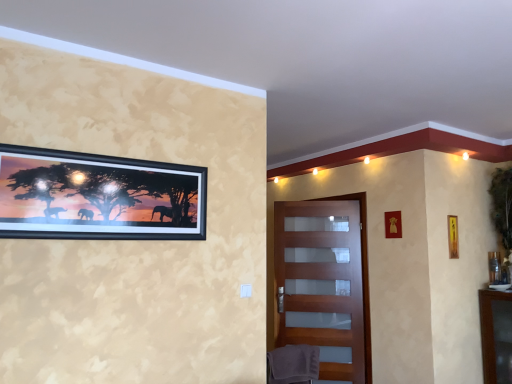
How much space does metallic gold picture frame at right, which is the fourth picture frame in front-to-back order, occupy horizontally?

4.09 inches.

What do you see at coordinates (98, 196) in the screenshot? I see `black matte picture frame at upper left, positioned as the 1th picture frame in front-to-back order` at bounding box center [98, 196].

At what (x,y) coordinates should I click in order to perform the action: click on wooden picture frame at upper right, placed as the 3th picture frame when sorted from back to front. Please return your answer as a coordinate pair (x, y). Looking at the image, I should click on (453, 237).

This screenshot has height=384, width=512. What do you see at coordinates (393, 224) in the screenshot?
I see `metallic gold picture frame at upper right, which is the third picture frame in right-to-left order` at bounding box center [393, 224].

What do you see at coordinates (325, 283) in the screenshot? The image size is (512, 384). I see `matte wooden door at center` at bounding box center [325, 283].

In order to face gray fabric swivel chair at lower center, should I rotate leftwards or rightwards?

You should rotate right by 5.059 degrees.

The width and height of the screenshot is (512, 384). What are the coordinates of `metallic gold picture frame at right, which is counted as the 1th picture frame, starting from the right` in the screenshot? It's located at (495, 267).

Is metallic gold picture frame at right, arranged as the 1th picture frame when viewed from the back, positioned beyond the bounds of black matte picture frame at upper left, which appears as the fourth picture frame when viewed from the right?

Yes, metallic gold picture frame at right, arranged as the 1th picture frame when viewed from the back, is not within black matte picture frame at upper left, which appears as the fourth picture frame when viewed from the right.

Which of these two, metallic gold picture frame at right, positioned as the fourth picture frame in left-to-right order, or black matte picture frame at upper left, positioned as the 1th picture frame in front-to-back order, is bigger?

black matte picture frame at upper left, positioned as the 1th picture frame in front-to-back order, is bigger.

How different are the orientations of metallic gold picture frame at right, arranged as the 1th picture frame when viewed from the back, and black matte picture frame at upper left, positioned as the 1th picture frame in front-to-back order, in degrees?

The facing directions of metallic gold picture frame at right, arranged as the 1th picture frame when viewed from the back, and black matte picture frame at upper left, positioned as the 1th picture frame in front-to-back order, are 89.3 degrees apart.

From the image's perspective, who appears lower, metallic gold picture frame at right, which is the fourth picture frame in front-to-back order, or black matte picture frame at upper left, arranged as the first picture frame when viewed from the left?

From the image's view, metallic gold picture frame at right, which is the fourth picture frame in front-to-back order, is below.

Is wooden picture frame at upper right, positioned as the second picture frame in front-to-back order, wider or thinner than gray fabric swivel chair at lower center?

In the image, wooden picture frame at upper right, positioned as the second picture frame in front-to-back order, appears to be more narrow than gray fabric swivel chair at lower center.

Could you measure the distance between wooden picture frame at upper right, placed as the 3th picture frame when sorted from left to right, and gray fabric swivel chair at lower center?

wooden picture frame at upper right, placed as the 3th picture frame when sorted from left to right, and gray fabric swivel chair at lower center are 1.85 meters apart from each other.

At what (x,y) coordinates should I click in order to perform the action: click on swivel chair below the wooden picture frame at upper right, placed as the 3th picture frame when sorted from left to right (from the image's perspective). Please return your answer as a coordinate pair (x, y). Looking at the image, I should click on (293, 364).

Consider the image. From the image's perspective, who appears lower, wooden picture frame at upper right, acting as the 2th picture frame starting from the right, or gray fabric swivel chair at lower center?

gray fabric swivel chair at lower center appears lower in the image.

From the picture: Does matte wooden door at center have a larger size compared to metallic gold picture frame at right, which is the fourth picture frame in front-to-back order?

Indeed, matte wooden door at center has a larger size compared to metallic gold picture frame at right, which is the fourth picture frame in front-to-back order.

Visually, is matte wooden door at center positioned to the left or to the right of metallic gold picture frame at right, which is counted as the 1th picture frame, starting from the right?

Clearly, matte wooden door at center is on the left of metallic gold picture frame at right, which is counted as the 1th picture frame, starting from the right, in the image.

From the image's perspective, is matte wooden door at center located beneath metallic gold picture frame at right, positioned as the fourth picture frame in left-to-right order?

Yes, from the image's perspective, matte wooden door at center is below metallic gold picture frame at right, positioned as the fourth picture frame in left-to-right order.

In the scene shown: Is matte wooden door at center completely or partially outside of metallic gold picture frame at right, which is counted as the 1th picture frame, starting from the right?

matte wooden door at center is positioned outside metallic gold picture frame at right, which is counted as the 1th picture frame, starting from the right.

Is wooden picture frame at upper right, acting as the 2th picture frame starting from the right, wider than matte wooden door at center?

Incorrect, the width of wooden picture frame at upper right, acting as the 2th picture frame starting from the right, does not surpass that of matte wooden door at center.

Considering the sizes of objects wooden picture frame at upper right, positioned as the second picture frame in front-to-back order, and matte wooden door at center in the image provided, who is smaller, wooden picture frame at upper right, positioned as the second picture frame in front-to-back order, or matte wooden door at center?

wooden picture frame at upper right, positioned as the second picture frame in front-to-back order, is smaller.

Based on the photo, what's the angular difference between wooden picture frame at upper right, acting as the 2th picture frame starting from the right, and matte wooden door at center's facing directions?

The angle between the facing direction of wooden picture frame at upper right, acting as the 2th picture frame starting from the right, and the facing direction of matte wooden door at center is 25.7 degrees.

Would you say wooden picture frame at upper right, placed as the 3th picture frame when sorted from back to front, is to the left or to the right of matte wooden door at center in the picture?

wooden picture frame at upper right, placed as the 3th picture frame when sorted from back to front, is positioned on matte wooden door at center's right side.

Is metallic gold picture frame at upper right, the second picture frame in the back-to-front sequence, in front of or behind matte wooden door at center in the image?

Clearly, metallic gold picture frame at upper right, the second picture frame in the back-to-front sequence, is in front of matte wooden door at center.

Is metallic gold picture frame at upper right, marked as the third picture frame in a front-to-back arrangement, not near matte wooden door at center?

They are positioned close to each other.

Locate an element on the screen. This screenshot has width=512, height=384. door below the metallic gold picture frame at upper right, the second picture frame in the back-to-front sequence (from a real-world perspective) is located at coordinates (325, 283).

From the picture: Visually, is metallic gold picture frame at upper right, the second picture frame in the back-to-front sequence, positioned to the left or to the right of matte wooden door at center?

Based on their positions, metallic gold picture frame at upper right, the second picture frame in the back-to-front sequence, is located to the right of matte wooden door at center.

From a real-world perspective, which object rests below the other?

wooden picture frame at upper right, acting as the 2th picture frame starting from the right.

Between wooden picture frame at upper right, placed as the 3th picture frame when sorted from back to front, and black matte picture frame at upper left, positioned as the 1th picture frame in front-to-back order, which one has larger size?

With larger size is black matte picture frame at upper left, positioned as the 1th picture frame in front-to-back order.

Visually, is wooden picture frame at upper right, positioned as the second picture frame in front-to-back order, positioned to the left or to the right of black matte picture frame at upper left, positioned as the 1th picture frame in front-to-back order?

In the image, wooden picture frame at upper right, positioned as the second picture frame in front-to-back order, appears on the right side of black matte picture frame at upper left, positioned as the 1th picture frame in front-to-back order.

From the image's perspective, which object appears higher, wooden picture frame at upper right, placed as the 3th picture frame when sorted from left to right, or black matte picture frame at upper left, which appears as the fourth picture frame when viewed from the right?

From the image's view, black matte picture frame at upper left, which appears as the fourth picture frame when viewed from the right, is above.

Would you say metallic gold picture frame at upper right, marked as the third picture frame in a front-to-back arrangement, is outside gray fabric swivel chair at lower center?

Yes, metallic gold picture frame at upper right, marked as the third picture frame in a front-to-back arrangement, is outside of gray fabric swivel chair at lower center.

Is metallic gold picture frame at upper right, marked as the third picture frame in a front-to-back arrangement, to the right of gray fabric swivel chair at lower center from the viewer's perspective?

Yes, metallic gold picture frame at upper right, marked as the third picture frame in a front-to-back arrangement, is to the right of gray fabric swivel chair at lower center.

From the picture: Is metallic gold picture frame at upper right, which is the third picture frame in right-to-left order, aimed at gray fabric swivel chair at lower center?

No, metallic gold picture frame at upper right, which is the third picture frame in right-to-left order, is not oriented towards gray fabric swivel chair at lower center.

Is metallic gold picture frame at upper right, which is the third picture frame in right-to-left order, shorter than gray fabric swivel chair at lower center?

Indeed, metallic gold picture frame at upper right, which is the third picture frame in right-to-left order, has a lesser height compared to gray fabric swivel chair at lower center.

Locate an element on the screen. picture frame that is the 3rd one when counting upward from the metallic gold picture frame at right, which is the fourth picture frame in front-to-back order (from the image's perspective) is located at coordinates (98, 196).

Where is `swivel chair that is below the wooden picture frame at upper right, positioned as the second picture frame in front-to-back order (from the image's perspective)`? This screenshot has height=384, width=512. swivel chair that is below the wooden picture frame at upper right, positioned as the second picture frame in front-to-back order (from the image's perspective) is located at coordinates (293, 364).

Estimate the real-world distances between objects in this image. Which object is further from wooden picture frame at upper right, positioned as the second picture frame in front-to-back order, metallic gold picture frame at upper right, marked as the third picture frame in a front-to-back arrangement, or metallic gold picture frame at right, arranged as the 1th picture frame when viewed from the back?

metallic gold picture frame at right, arranged as the 1th picture frame when viewed from the back, is positioned further to the anchor wooden picture frame at upper right, positioned as the second picture frame in front-to-back order.

From the image, which object appears to be farther from black matte picture frame at upper left, which appears as the fourth picture frame when viewed from the right, metallic gold picture frame at upper right, the second picture frame in the back-to-front sequence, or gray fabric swivel chair at lower center?

metallic gold picture frame at upper right, the second picture frame in the back-to-front sequence.

When comparing their distances from matte wooden door at center, does black matte picture frame at upper left, positioned as the 1th picture frame in front-to-back order, or metallic gold picture frame at right, which is the fourth picture frame in front-to-back order, seem further?

black matte picture frame at upper left, positioned as the 1th picture frame in front-to-back order, lies further to matte wooden door at center than the other object.

In the scene shown: Considering their positions, is metallic gold picture frame at right, which is counted as the 1th picture frame, starting from the right, positioned closer to wooden picture frame at upper right, acting as the 2th picture frame starting from the right, than black matte picture frame at upper left, positioned as the 1th picture frame in front-to-back order?

metallic gold picture frame at right, which is counted as the 1th picture frame, starting from the right, is closer to wooden picture frame at upper right, acting as the 2th picture frame starting from the right.

When comparing their distances from wooden picture frame at upper right, placed as the 3th picture frame when sorted from back to front, does gray fabric swivel chair at lower center or metallic gold picture frame at right, which is the fourth picture frame in front-to-back order, seem closer?

metallic gold picture frame at right, which is the fourth picture frame in front-to-back order.

From the picture: Looking at the image, which one is located further to black matte picture frame at upper left, arranged as the first picture frame when viewed from the left, wooden picture frame at upper right, placed as the 3th picture frame when sorted from left to right, or metallic gold picture frame at upper right, acting as the second picture frame starting from the left?

wooden picture frame at upper right, placed as the 3th picture frame when sorted from left to right, lies further to black matte picture frame at upper left, arranged as the first picture frame when viewed from the left, than the other object.

Based on their spatial positions, is gray fabric swivel chair at lower center or matte wooden door at center further from wooden picture frame at upper right, positioned as the second picture frame in front-to-back order?

The object further to wooden picture frame at upper right, positioned as the second picture frame in front-to-back order, is gray fabric swivel chair at lower center.

Based on their spatial positions, is metallic gold picture frame at right, which is the fourth picture frame in front-to-back order, or wooden picture frame at upper right, positioned as the second picture frame in front-to-back order, closer to black matte picture frame at upper left, arranged as the first picture frame when viewed from the left?

Among the two, wooden picture frame at upper right, positioned as the second picture frame in front-to-back order, is located nearer to black matte picture frame at upper left, arranged as the first picture frame when viewed from the left.

Image resolution: width=512 pixels, height=384 pixels. Find the location of `door between black matte picture frame at upper left, which appears as the fourth picture frame when viewed from the right, and wooden picture frame at upper right, acting as the 2th picture frame starting from the right, in the horizontal direction`. door between black matte picture frame at upper left, which appears as the fourth picture frame when viewed from the right, and wooden picture frame at upper right, acting as the 2th picture frame starting from the right, in the horizontal direction is located at coordinates (325, 283).

The width and height of the screenshot is (512, 384). What are the coordinates of `swivel chair situated between black matte picture frame at upper left, which is the fourth picture frame in back-to-front order, and metallic gold picture frame at right, arranged as the 1th picture frame when viewed from the back, from left to right` in the screenshot? It's located at (293, 364).

Find the location of `door located between gray fabric swivel chair at lower center and metallic gold picture frame at right, which is the fourth picture frame in front-to-back order, in the left-right direction`. door located between gray fabric swivel chair at lower center and metallic gold picture frame at right, which is the fourth picture frame in front-to-back order, in the left-right direction is located at coordinates (325, 283).

Where is `swivel chair between black matte picture frame at upper left, which is the fourth picture frame in back-to-front order, and matte wooden door at center, along the z-axis`? The height and width of the screenshot is (384, 512). swivel chair between black matte picture frame at upper left, which is the fourth picture frame in back-to-front order, and matte wooden door at center, along the z-axis is located at coordinates (293, 364).